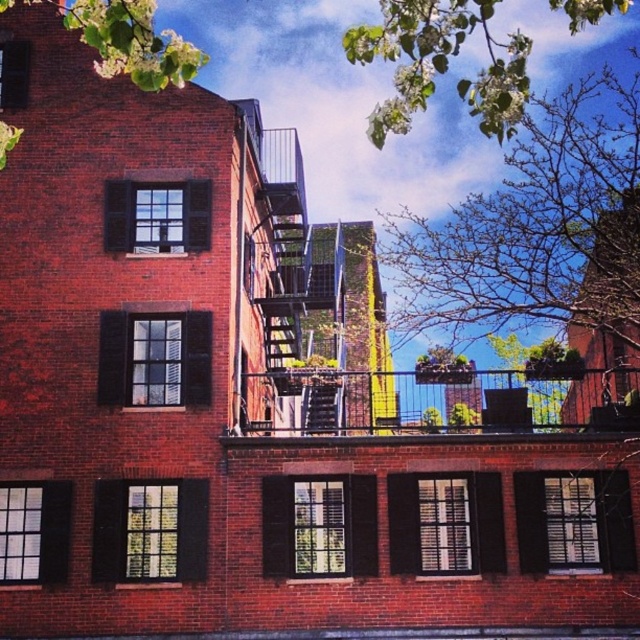
Looking at this image, who is lower down, metallic silver balcony at center or green leafy branches at upper center?

Positioned lower is metallic silver balcony at center.

Can you confirm if metallic silver balcony at center is thinner than green leafy branches at upper center?

Correct, metallic silver balcony at center's width is less than green leafy branches at upper center's.

Who is more distant from viewer, (x=426, y=422) or (x=344, y=42)?

The point (x=426, y=422) is more distant.

Find the location of a particular element. The image size is (640, 640). metallic silver balcony at center is located at coordinates (436, 403).

Does green leafy branches at upper center have a lesser width compared to green leafy tree at upper left?

In fact, green leafy branches at upper center might be wider than green leafy tree at upper left.

Does green leafy branches at upper center appear on the right side of green leafy tree at upper left?

Indeed, green leafy branches at upper center is positioned on the right side of green leafy tree at upper left.

Locate an element on the screen. This screenshot has width=640, height=640. green leafy branches at upper center is located at coordinates (442, 64).

Where is `green leafy branches at upper center`? This screenshot has width=640, height=640. green leafy branches at upper center is located at coordinates pyautogui.click(x=442, y=64).

Does metallic silver balcony at center appear on the left side of green leafy tree at upper left?

Incorrect, metallic silver balcony at center is not on the left side of green leafy tree at upper left.

Does metallic silver balcony at center have a lesser height compared to green leafy tree at upper left?

Correct, metallic silver balcony at center is not as tall as green leafy tree at upper left.

Locate an element on the screen. metallic silver balcony at center is located at coordinates (436, 403).

The width and height of the screenshot is (640, 640). Identify the location of metallic silver balcony at center. (436, 403).